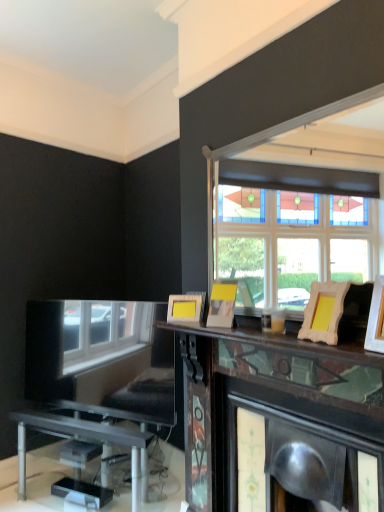
Question: Can you confirm if wooden picture frame at upper right, acting as the third picture frame starting from the left, is positioned to the left of yellow matte picture frame at upper center, the third picture frame viewed from the front?

Choices:
 (A) no
 (B) yes

Answer: (A)

Question: Is wooden picture frame at upper right, acting as the third picture frame starting from the left, not close to yellow matte picture frame at upper center, which appears as the second picture frame when viewed from the back?

Choices:
 (A) no
 (B) yes

Answer: (A)

Question: Is wooden picture frame at upper right, which is counted as the 3th picture frame, starting from the back, further to camera compared to yellow matte picture frame at upper center, the third picture frame viewed from the front?

Choices:
 (A) yes
 (B) no

Answer: (B)

Question: Is wooden picture frame at upper right, which ranks as the second picture frame in right-to-left order, oriented away from yellow matte picture frame at upper center, the third picture frame viewed from the front?

Choices:
 (A) no
 (B) yes

Answer: (A)

Question: Is wooden picture frame at upper right, which is counted as the 3th picture frame, starting from the back, taller than yellow matte picture frame at upper center, the third picture frame viewed from the front?

Choices:
 (A) yes
 (B) no

Answer: (A)

Question: In the image, is wooden picture frame at upper right, acting as the third picture frame starting from the left, positioned in front of or behind yellow matte picture frame at upper center, the second picture frame when ordered from left to right?

Choices:
 (A) front
 (B) behind

Answer: (A)

Question: From a real-world perspective, is wooden picture frame at upper right, which is counted as the 3th picture frame, starting from the back, positioned above or below yellow matte picture frame at upper center, the 3th picture frame positioned from the right?

Choices:
 (A) above
 (B) below

Answer: (B)

Question: From the image's perspective, is wooden picture frame at upper right, which ranks as the second picture frame in right-to-left order, above or below yellow matte picture frame at upper center, which appears as the second picture frame when viewed from the back?

Choices:
 (A) above
 (B) below

Answer: (A)

Question: Looking at the image, does wooden picture frame at upper right, arranged as the 2th picture frame when viewed from the front, seem bigger or smaller compared to yellow matte picture frame at upper center, the second picture frame when ordered from left to right?

Choices:
 (A) big
 (B) small

Answer: (A)

Question: From their relative heights in the image, would you say wooden picture frame at right, arranged as the first picture frame when viewed from the front, is taller or shorter than yellow matte picture frame at upper center, the second picture frame when ordered from left to right?

Choices:
 (A) tall
 (B) short

Answer: (A)

Question: Considering the positions of point (370, 311) and point (216, 291), is point (370, 311) closer or farther from the camera than point (216, 291)?

Choices:
 (A) closer
 (B) farther

Answer: (A)

Question: Is wooden picture frame at right, arranged as the 4th picture frame when viewed from the back, inside the boundaries of yellow matte picture frame at upper center, the third picture frame viewed from the front, or outside?

Choices:
 (A) inside
 (B) outside

Answer: (B)

Question: From the image's perspective, is wooden picture frame at right, arranged as the first picture frame when viewed from the front, located above or below yellow matte picture frame at upper center, the second picture frame when ordered from left to right?

Choices:
 (A) above
 (B) below

Answer: (A)

Question: Is wooden picture frame at right, arranged as the first picture frame when viewed from the front, to the left or to the right of yellow matte picture frame at center, the first picture frame viewed from the back, in the image?

Choices:
 (A) left
 (B) right

Answer: (B)

Question: In the image, is wooden picture frame at right, the fourth picture frame viewed from the left, positioned in front of or behind yellow matte picture frame at center, acting as the 4th picture frame starting from the front?

Choices:
 (A) front
 (B) behind

Answer: (A)